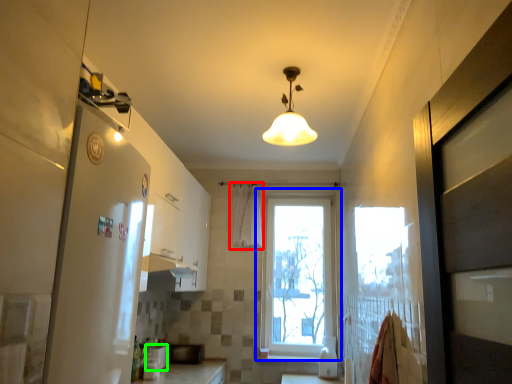
Question: Which object is positioned farthest from shower curtain (highlighted by a red box)? Select from window (highlighted by a blue box) and appliance (highlighted by a green box).

Choices:
 (A) window
 (B) appliance

Answer: (B)